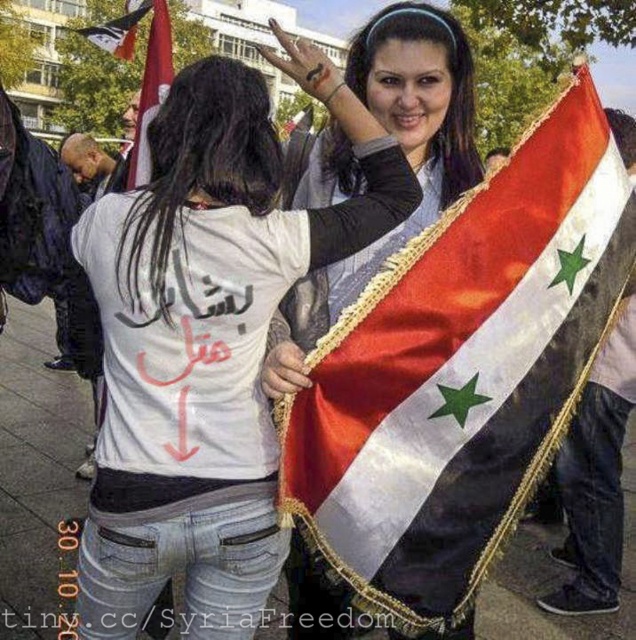
Question: Does silky fabric flag at upper right have a larger size compared to white matte t-shirt at center?

Choices:
 (A) no
 (B) yes

Answer: (A)

Question: Which object is the closest to the red fabric flag at upper left?

Choices:
 (A) silky fabric flag at upper right
 (B) black fabric flag at upper left
 (C) white matte t-shirt at center

Answer: (C)

Question: Is red fabric flag at upper left behind black fabric flag at upper left?

Choices:
 (A) no
 (B) yes

Answer: (A)

Question: Which object is closer to the camera taking this photo?

Choices:
 (A) red fabric flag at upper left
 (B) white matte t-shirt at center

Answer: (B)

Question: Is silky fabric flag at upper right positioned at the back of red fabric flag at upper left?

Choices:
 (A) no
 (B) yes

Answer: (A)

Question: Which object appears closest to the camera in this image?

Choices:
 (A) black fabric flag at upper left
 (B) red fabric flag at upper left
 (C) white matte t-shirt at center

Answer: (C)